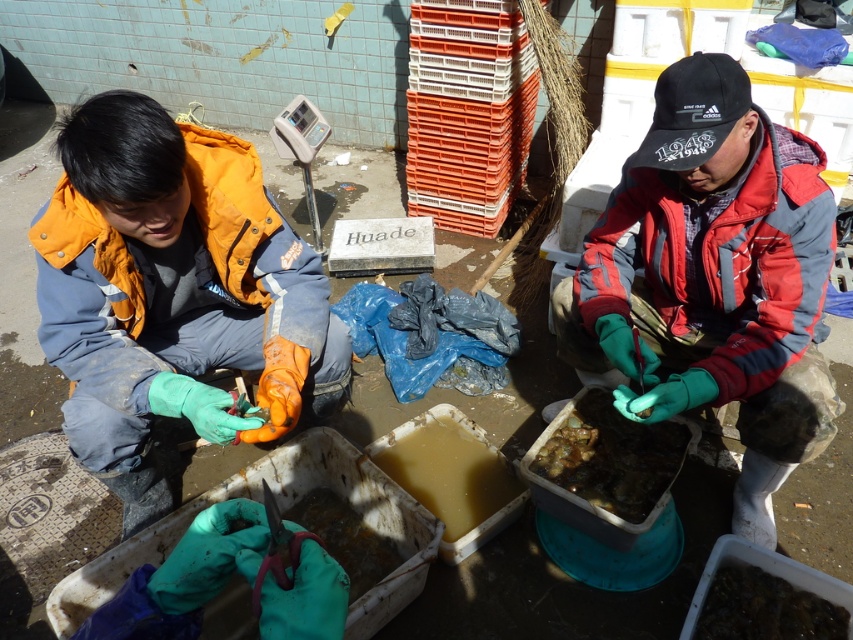
You are a customer observing the scene. You want to know which object is higher in position between the orange matte jacket at left and the brown rubbery food at center. Based on the scene, can you determine this?

The orange matte jacket at left is located above the brown rubbery food at center, so the orange matte jacket at left is higher in position.

You are a customer at the seafood market and want to ask the vendor about the brown rubbery food at center. Which vendor should you approach first, the one wearing the orange matte jacket at left or the one wearing the red and gray jacket at right?

You should approach the vendor wearing the orange matte jacket at left first because they are closer to you than the brown rubbery food at center, indicating they are nearer to your position as a customer.

You are standing in front of a 1.5 meter wide counter. There is a red and gray jacket at center. Can you reach the jacket without moving your position?

The red and gray jacket at center is 1.31 meters from the viewer, which is within the 1.5 meter width of the counter. Therefore, you can reach the jacket without moving your position.